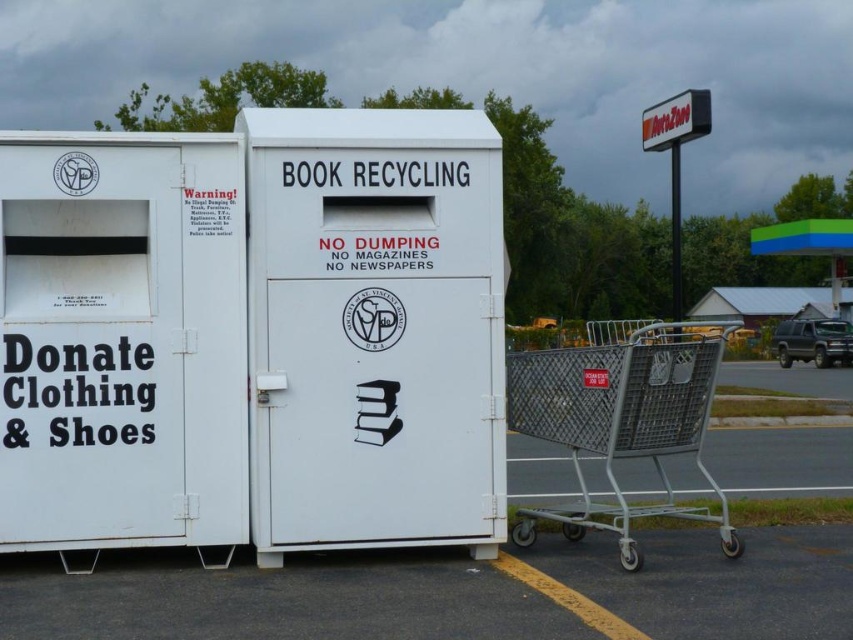
You are trying to determine if both the white metal shopping cart at lower right and the metallic gray shopping cart at lower right can fit side by side in a space that is 1.5 meters wide. Based on their widths, will they both fit?

The white metal shopping cart at lower right is narrower than the metallic gray shopping cart at lower right. However, since the combined width of both carts is not specified, we cannot determine if they will fit in the 1.5 meters space without additional information.

You are standing in the parking lot and need to place a bag of old books next to the white plastic sign at upper center. Can you move the metallic gray shopping cart at lower right out of the way to make space?

The metallic gray shopping cart at lower right is located below the white plastic sign at upper center, so you can move the metallic gray shopping cart at lower right out of the way to create space next to the white plastic sign at upper center.

You are standing in the parking lot and need to return a borrowed white metal shopping cart to its designated spot. The parking lot has two recycling bins nearby. Where should you place the white metal shopping cart at lower right?

The white metal shopping cart at lower right should be returned to its designated spot, which is at point (498, 577) as per the provided coordinates.